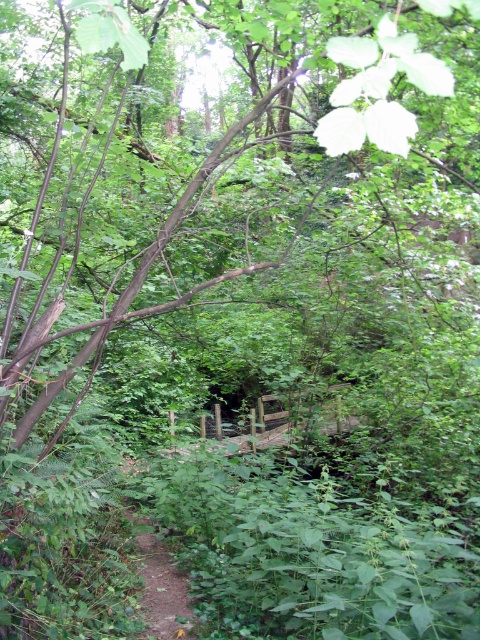
Who is more distant from viewer, [112,77] or [163,602]?

The point [112,77] is more distant.

Is brown wood tree at center closer to camera compared to brown dirt path at lower left?

Yes, brown wood tree at center is closer to the viewer.

Describe the element at coordinates (217, 173) in the screenshot. This screenshot has width=480, height=640. I see `brown wood tree at center` at that location.

This screenshot has width=480, height=640. I want to click on brown wood tree at center, so click(x=217, y=173).